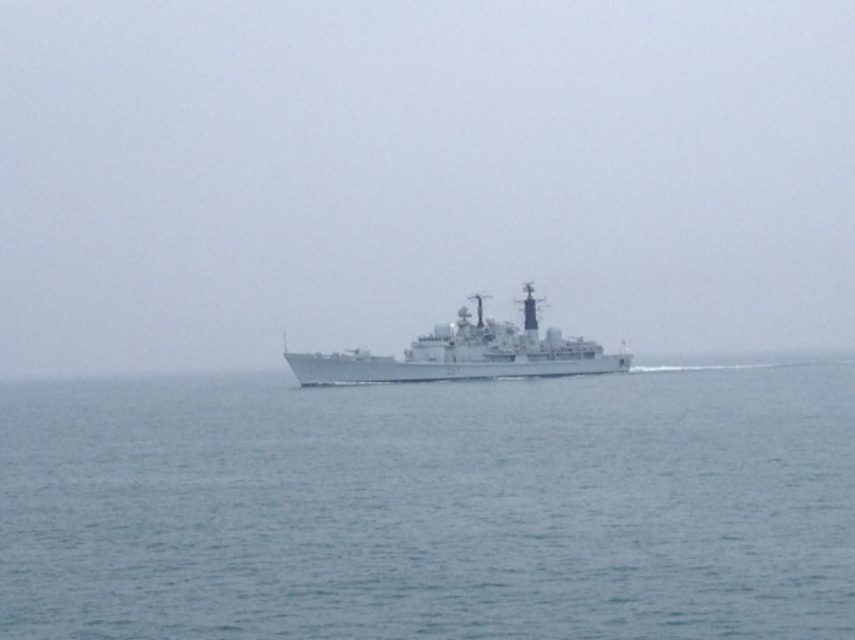
Which is above, blue water at center or gray metallic ship at center?

gray metallic ship at center is higher up.

Based on the photo, is blue water at center positioned before gray metallic ship at center?

Yes, it is.

Which is in front, point (257, 572) or point (399, 380)?

Point (257, 572) is more forward.

Find the location of a particular element. This screenshot has height=640, width=855. blue water at center is located at coordinates (432, 508).